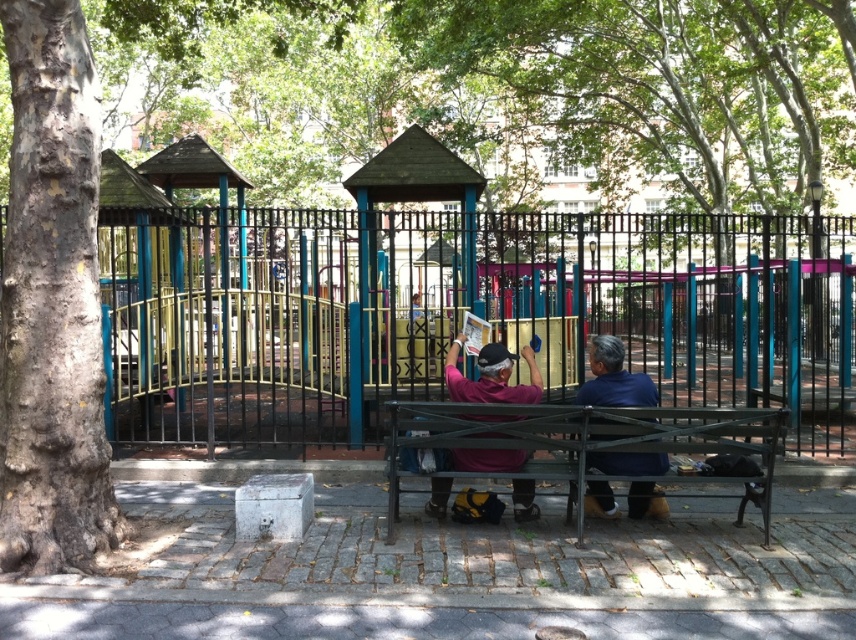
Can you confirm if green leafy tree at center is positioned to the right of metallic green bench at center?

Correct, you'll find green leafy tree at center to the right of metallic green bench at center.

Is point (595, 74) positioned in front of point (509, 422)?

No.

Measure the distance between green leafy tree at center and camera.

green leafy tree at center and camera are 7.70 meters apart from each other.

I want to click on green leafy tree at center, so [667, 84].

Can you confirm if metallic black fence at center is positioned to the left of metallic green bench at center?

In fact, metallic black fence at center is to the right of metallic green bench at center.

Does point (715, 280) come farther from viewer compared to point (621, 449)?

That is True.

Is point (846, 250) positioned after point (687, 406)?

Yes.

Image resolution: width=856 pixels, height=640 pixels. Find the location of `metallic black fence at center`. metallic black fence at center is located at coordinates (461, 314).

In the scene shown: Between rough bark tree at left and metallic green bench at center, which one is positioned higher?

Positioned higher is rough bark tree at left.

In the scene shown: Is rough bark tree at left positioned before metallic green bench at center?

Yes, it is.

Which is in front, point (57, 381) or point (510, 419)?

Positioned in front is point (57, 381).

At what (x,y) coordinates should I click in order to perform the action: click on rough bark tree at left. Please return your answer as a coordinate pair (x, y). This screenshot has height=640, width=856. Looking at the image, I should click on (52, 301).